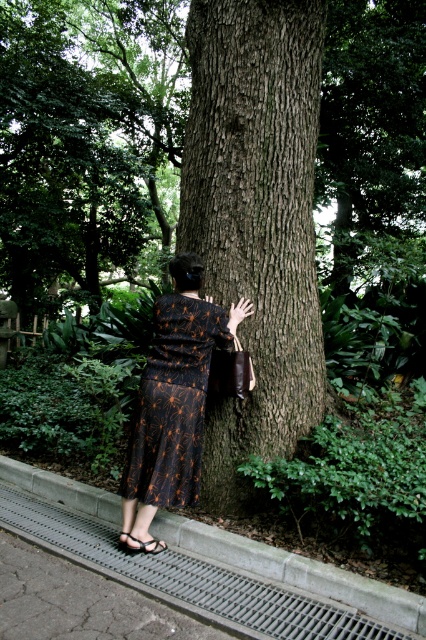
Question: Among these objects, which one is farthest from the camera?

Choices:
 (A) gray concrete curb at lower left
 (B) brown rough bark at center
 (C) black textured dress at center

Answer: (B)

Question: Does brown rough bark at center appear over black textured dress at center?

Choices:
 (A) yes
 (B) no

Answer: (A)

Question: Which object is farther from the camera taking this photo?

Choices:
 (A) gray concrete curb at lower left
 (B) brown rough bark at center
 (C) black textured dress at center

Answer: (B)

Question: Where is brown rough bark at center located in relation to gray concrete curb at lower left in the image?

Choices:
 (A) left
 (B) right

Answer: (B)

Question: Can you confirm if brown rough bark at center is positioned to the right of gray concrete curb at lower left?

Choices:
 (A) no
 (B) yes

Answer: (B)

Question: Among these points, which one is nearest to the camera?

Choices:
 (A) 149,416
 (B) 158,570

Answer: (B)